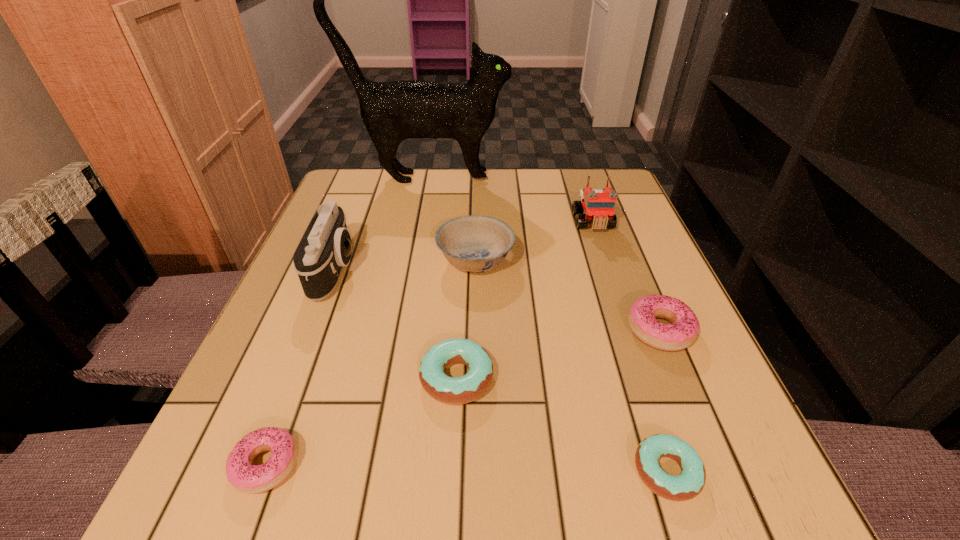
Find the location of `black cat`. black cat is located at coordinates (393, 111).

In order to click on the farthest object in this screenshot , I will do pyautogui.click(x=393, y=111).

At what (x,y) coordinates should I click in order to perform the action: click on camera. Please return your answer as a coordinate pair (x, y). The width and height of the screenshot is (960, 540). Looking at the image, I should click on (325, 247).

Find the location of a particular element. the sixth shortest object is located at coordinates (599, 205).

I want to click on Lego, so click(x=599, y=205).

Identify the location of the fifth shortest object. The width and height of the screenshot is (960, 540). (474, 243).

What are the coordinates of `bowl` in the screenshot? It's located at (474, 243).

The height and width of the screenshot is (540, 960). I want to click on the tallest doughnut, so click(681, 333).

The width and height of the screenshot is (960, 540). I want to click on the bigger pink doughnut, so click(681, 333).

Find the location of a particular element. This screenshot has height=540, width=960. the second doughnut from left to right is located at coordinates (449, 390).